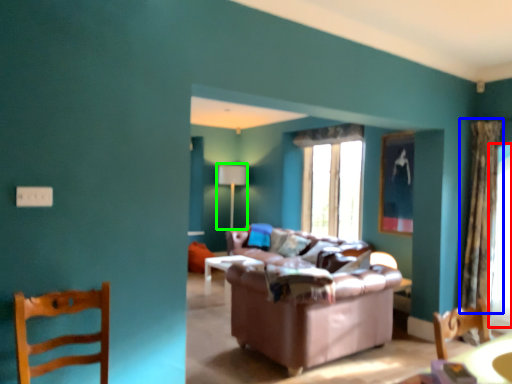
Question: Which object is the closest to the window screen (highlighted by a red box)? Choose among these: curtain (highlighted by a blue box) or lamp (highlighted by a green box).

Choices:
 (A) curtain
 (B) lamp

Answer: (A)